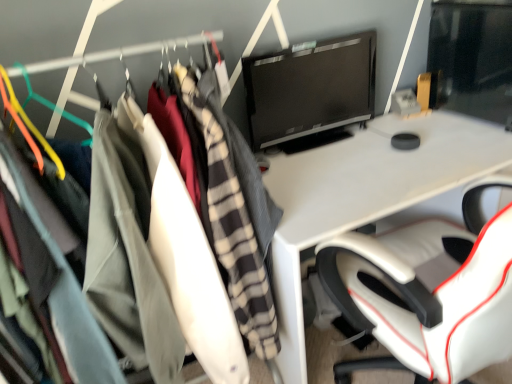
Find the location of a particular element. free space in front of black glossy monitor at upper right is located at coordinates (344, 170).